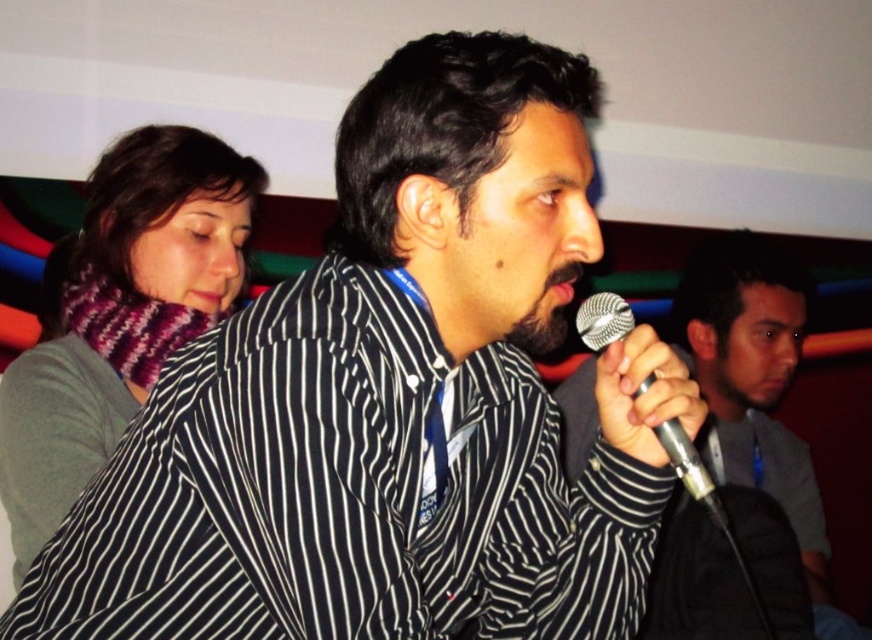
Question: Which object is positioned farthest from the black matte microphone at center?

Choices:
 (A) knitted wool scarf at upper left
 (B) silver metallic microphone at center

Answer: (B)

Question: Can you confirm if knitted wool scarf at upper left is wider than black matte microphone at center?

Choices:
 (A) no
 (B) yes

Answer: (A)

Question: Can you confirm if knitted wool scarf at upper left is thinner than black matte microphone at center?

Choices:
 (A) no
 (B) yes

Answer: (B)

Question: Which point is farther to the camera?

Choices:
 (A) (588, 307)
 (B) (109, 330)
 (C) (788, 451)

Answer: (C)

Question: Considering the relative positions of knitted wool scarf at upper left and black matte microphone at center in the image provided, where is knitted wool scarf at upper left located with respect to black matte microphone at center?

Choices:
 (A) below
 (B) above

Answer: (B)

Question: Which of the following is the farthest from the observer?

Choices:
 (A) knitted wool scarf at upper left
 (B) silver metallic microphone at center

Answer: (A)